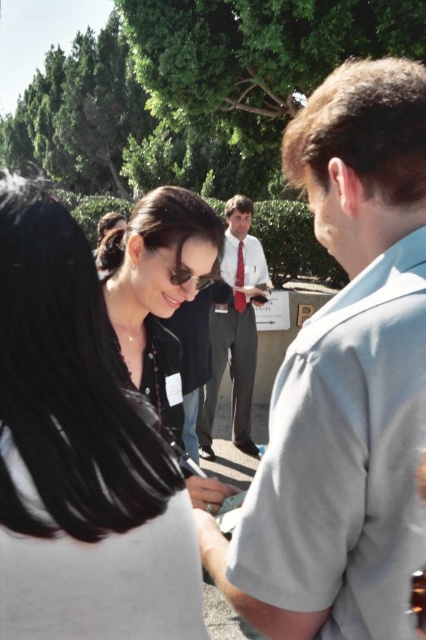
Question: Which point is farther to the camera?

Choices:
 (A) (238, 301)
 (B) (127, 326)
 (C) (187, 620)

Answer: (A)

Question: Observing the image, what is the correct spatial positioning of light gray shirt at center in reference to matte black jacket at center?

Choices:
 (A) right
 (B) left

Answer: (A)

Question: Does matte black jacket at center have a lesser width compared to matte black shirt at center?

Choices:
 (A) no
 (B) yes

Answer: (B)

Question: Which of these objects is positioned closest to the matte black jacket at center?

Choices:
 (A) red satin tie at center
 (B) gray suit at center
 (C) matte black shirt at center

Answer: (C)

Question: Which point is closer to the camera taking this photo?

Choices:
 (A) (189, 268)
 (B) (126, 392)
 (C) (245, 420)
 (D) (235, 296)

Answer: (B)

Question: Is light gray shirt at center wider than matte black shirt at center?

Choices:
 (A) no
 (B) yes

Answer: (A)